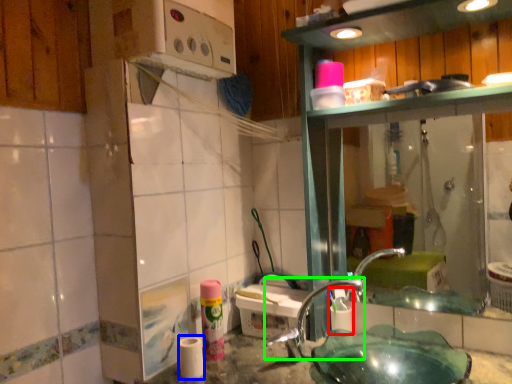
Question: Which object is the closest to the shaving cream (highlighted by a red box)? Choose among these: toilet paper (highlighted by a blue box) or faucet (highlighted by a green box).

Choices:
 (A) toilet paper
 (B) faucet

Answer: (B)